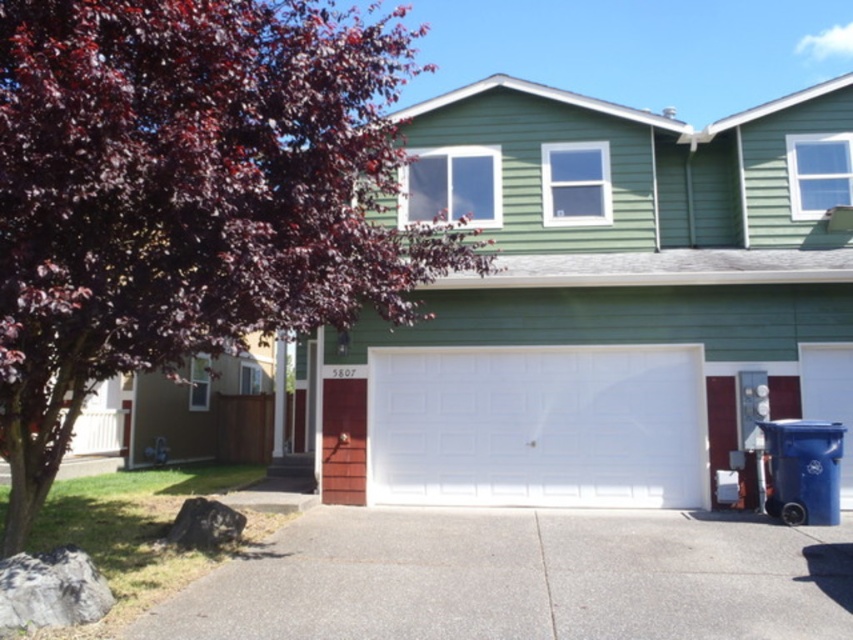
Find the location of a particular element. white smooth garage door at center is located at coordinates (599, 300).

Who is shorter, white smooth garage door at center or white painted wood garage door at center?

With less height is white smooth garage door at center.

This screenshot has width=853, height=640. In order to click on white smooth garage door at center in this screenshot , I will do `click(599, 300)`.

Does gray concrete driveway at lower center appear under white painted wood garage door at center?

Indeed, gray concrete driveway at lower center is positioned under white painted wood garage door at center.

What do you see at coordinates (521, 579) in the screenshot?
I see `gray concrete driveway at lower center` at bounding box center [521, 579].

Identify the location of gray concrete driveway at lower center. (521, 579).

Based on the photo, which is below, purple leafy tree at upper left or white painted wood garage door at center?

white painted wood garage door at center is below.

Does purple leafy tree at upper left appear on the right side of white painted wood garage door at center?

No, purple leafy tree at upper left is not to the right of white painted wood garage door at center.

Describe the element at coordinates (189, 196) in the screenshot. I see `purple leafy tree at upper left` at that location.

Identify the location of purple leafy tree at upper left. The image size is (853, 640). (189, 196).